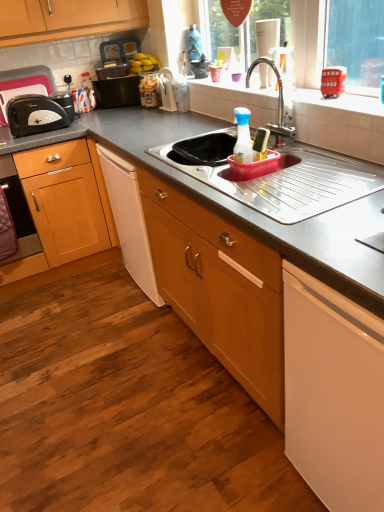
Question: Do you think yellow matte bananas at upper center is within white ceramic window sill at upper center, or outside of it?

Choices:
 (A) outside
 (B) inside

Answer: (A)

Question: In the image, is yellow matte bananas at upper center on the left side or the right side of white ceramic window sill at upper center?

Choices:
 (A) right
 (B) left

Answer: (B)

Question: Which object is the farthest from the white plastic dish rack at upper center, marked as the first appliance in a right-to-left arrangement?

Choices:
 (A) stainless steel sink at center
 (B) white ceramic window sill at upper center
 (C) black plastic toaster at left, which ranks as the 1th appliance in left-to-right order
 (D) white matte dishwasher at lower right
 (E) yellow matte bananas at upper center

Answer: (D)

Question: Estimate the real-world distances between objects in this image. Which object is farther from the white matte dishwasher at lower right?

Choices:
 (A) white plastic dish rack at upper center, marked as the first appliance in a right-to-left arrangement
 (B) silver metallic faucet at upper center
 (C) white ceramic window sill at upper center
 (D) stainless steel sink at center
 (E) white plastic bottle at sink

Answer: (A)